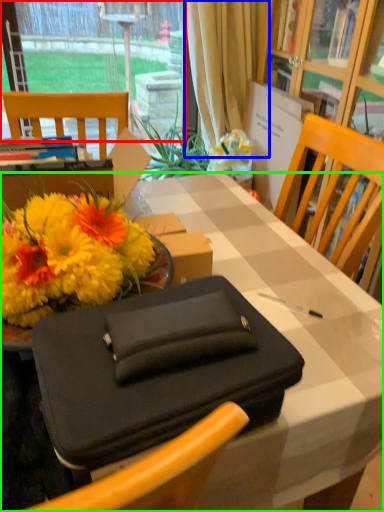
Question: Which is farther away from window (highlighted by a red box)? curtain (highlighted by a blue box) or desk (highlighted by a green box)?

Choices:
 (A) curtain
 (B) desk

Answer: (B)